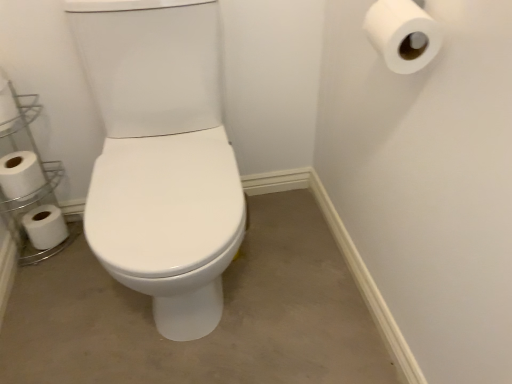
Question: Does white matte toilet paper at left, which is counted as the third toilet paper, starting from the left, appear on the right side of white matte toilet paper at lower left, positioned as the second toilet paper in back-to-front order?

Choices:
 (A) yes
 (B) no

Answer: (A)

Question: From a real-world perspective, is white matte toilet paper at left, marked as the 3th toilet paper in a back-to-front arrangement, on top of white matte toilet paper at lower left, which is counted as the 2th toilet paper, starting from the bottom?

Choices:
 (A) yes
 (B) no

Answer: (A)

Question: From the image's perspective, is white matte toilet paper at left, marked as the 3th toilet paper in a back-to-front arrangement, beneath white matte toilet paper at lower left, positioned as the second toilet paper in back-to-front order?

Choices:
 (A) no
 (B) yes

Answer: (A)

Question: Does white matte toilet paper at left, which is the 2th toilet paper from top to bottom, turn towards white matte toilet paper at lower left, positioned as the 3th toilet paper in right-to-left order?

Choices:
 (A) no
 (B) yes

Answer: (A)

Question: Is white matte toilet paper at left, which ranks as the second toilet paper in front-to-back order, not inside white matte toilet paper at lower left, which is counted as the 2th toilet paper, starting from the bottom?

Choices:
 (A) yes
 (B) no

Answer: (A)

Question: Is white matte toilet paper at lower left, which is counted as the 2th toilet paper, starting from the bottom, at the back of white matte toilet paper at left, which ranks as the second toilet paper in front-to-back order?

Choices:
 (A) no
 (B) yes

Answer: (A)

Question: Is white glossy toilet at center outside of white plastic shelf at left?

Choices:
 (A) yes
 (B) no

Answer: (A)

Question: Is white glossy toilet at center looking in the opposite direction of white plastic shelf at left?

Choices:
 (A) yes
 (B) no

Answer: (B)

Question: Does white glossy toilet at center have a greater height compared to white plastic shelf at left?

Choices:
 (A) yes
 (B) no

Answer: (B)

Question: From a real-world perspective, is white glossy toilet at center beneath white plastic shelf at left?

Choices:
 (A) no
 (B) yes

Answer: (B)

Question: Does white glossy toilet at center have a larger size compared to white plastic shelf at left?

Choices:
 (A) no
 (B) yes

Answer: (B)

Question: Considering the relative sizes of white glossy toilet at center and white plastic shelf at left in the image provided, is white glossy toilet at center smaller than white plastic shelf at left?

Choices:
 (A) yes
 (B) no

Answer: (B)

Question: Does white plastic shelf at left have a greater width compared to white glossy toilet at center?

Choices:
 (A) no
 (B) yes

Answer: (A)